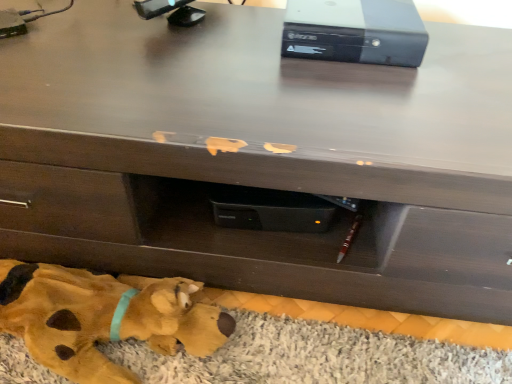
What are the coordinates of `blank space to the left of black plastic computer at upper center` in the screenshot? It's located at (228, 56).